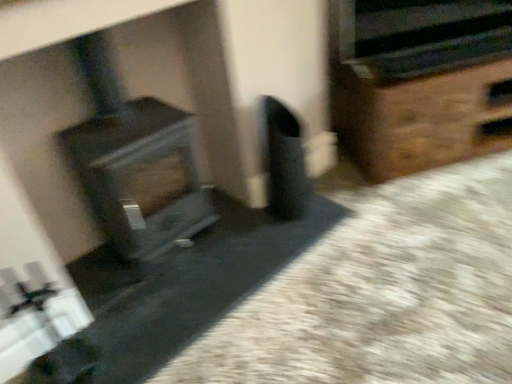
Question: Considering the positions of brown wooden chest at right and metallic silver stereo at upper right in the image, is brown wooden chest at right taller or shorter than metallic silver stereo at upper right?

Choices:
 (A) tall
 (B) short

Answer: (A)

Question: Considering the positions of brown wooden chest at right and metallic silver stereo at upper right in the image, is brown wooden chest at right bigger or smaller than metallic silver stereo at upper right?

Choices:
 (A) small
 (B) big

Answer: (B)

Question: Estimate the real-world distances between objects in this image. Which object is closer to the wood grain stove at left?

Choices:
 (A) metallic silver stereo at upper right
 (B) brown wooden chest at right

Answer: (B)

Question: Which object is positioned farthest from the wood grain stove at left?

Choices:
 (A) brown wooden chest at right
 (B) metallic silver stereo at upper right

Answer: (B)